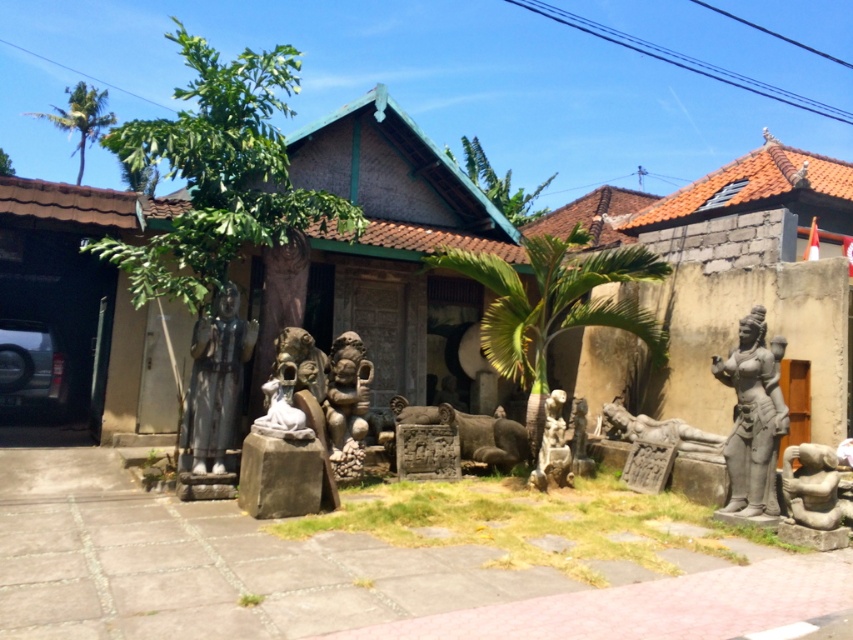
Question: Can you confirm if gray stone statue at lower right is smaller than gray stone statue at center?

Choices:
 (A) no
 (B) yes

Answer: (B)

Question: Among these points, which one is nearest to the camera?

Choices:
 (A) (346, 426)
 (B) (703, 445)
 (C) (708, 236)
 (D) (740, 506)

Answer: (D)

Question: Is matte brown wooden hut at center smaller than gray stone statue at right?

Choices:
 (A) no
 (B) yes

Answer: (B)

Question: Is brown stone hut at upper right bigger than metallic statue at center?

Choices:
 (A) yes
 (B) no

Answer: (A)

Question: Which of the following is the closest to the observer?

Choices:
 (A) gray stone statue at center
 (B) gray stone statue at lower right
 (C) brown stone hut at upper right
 (D) gray stone statue at right

Answer: (B)

Question: Among these points, which one is farthest from the camera?

Choices:
 (A) (344, 408)
 (B) (752, 376)

Answer: (A)